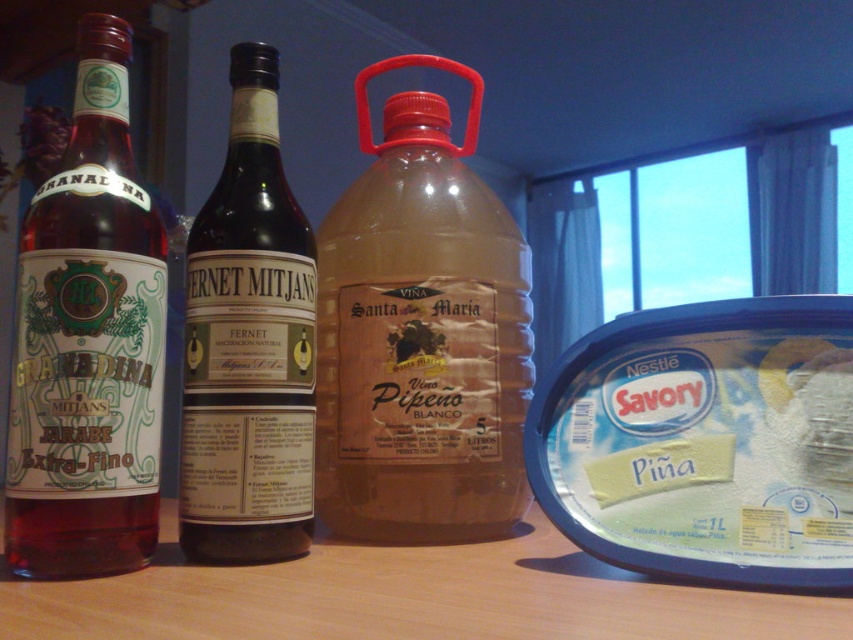
You are arranging items on a shelf and need to place the matte glass bottle at left and the dark glass bottle at center. Based on their positions in the image, which bottle should you place first to replicate the arrangement?

You should place the matte glass bottle at left first because it is in front of the dark glass bottle at center in the image.

You are a delivery person placing a new item on the table. You have to choose between placing it closer to point A at point (474, 291) or point B at point (97, 234). If you want the item to be as close as possible to the viewer, which point should you choose?

You should choose point A at point (474, 291) because it is closer to the viewer compared to point B at point (97, 234).

In the scene shown: You are setting up a table for a beverage tasting event. You have two bottles on the table, the translucent plastic bottle at center and the dark glass bottle at center. Which bottle should you place in a taller rack to accommodate their height?

The translucent plastic bottle at center is much taller than the dark glass bottle at center, so you should place the translucent plastic bottle at center in a taller rack to accommodate its height.